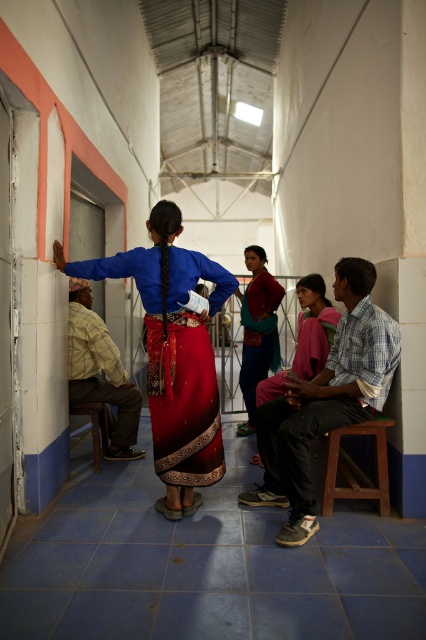
Is brown wooden stool at lower right to the right of brown wooden chair at lower left from the viewer's perspective?

Yes, brown wooden stool at lower right is to the right of brown wooden chair at lower left.

Find the location of a particular element. brown wooden stool at lower right is located at coordinates (356, 467).

Based on the photo, can you confirm if yellow plaid shirt at left is positioned to the right of matte red dress at center?

Incorrect, yellow plaid shirt at left is not on the right side of matte red dress at center.

Between point (112, 356) and point (267, 285), which one is positioned behind?

Point (267, 285)

This screenshot has height=640, width=426. What do you see at coordinates (100, 372) in the screenshot? I see `yellow plaid shirt at left` at bounding box center [100, 372].

This screenshot has width=426, height=640. I want to click on yellow plaid shirt at left, so click(100, 372).

Does pink fabric skirt at center lie behind brown wooden stool at lower right?

Yes, it is behind brown wooden stool at lower right.

Can you confirm if pink fabric skirt at center is taller than brown wooden stool at lower right?

Yes, pink fabric skirt at center is taller than brown wooden stool at lower right.

The height and width of the screenshot is (640, 426). I want to click on pink fabric skirt at center, so click(313, 326).